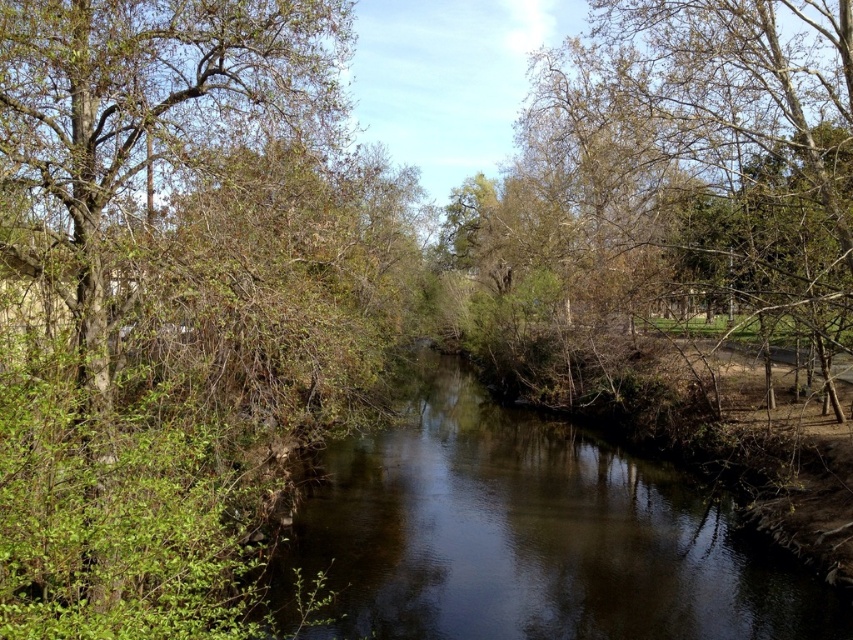
You are standing at the point with coordinates point (175, 296) in the image. What object is located at that point?

The point (175, 296) corresponds to the green leafy tree at left.

You are standing at the riverbank and want to take a photo of the green leafy tree at left. If your camera can focus up to 5 meters away, will you be able to capture the tree clearly?

The green leafy tree at left is 4.76 meters away from the camera. Since the camera can focus up to 5 meters, you can capture the tree clearly as the distance is within the focus range.

You are standing at the center of the image. Which direction should you walk to reach the green leafy tree at left?

You should walk to the left to reach the green leafy tree at left since it is located at the left side of the image.